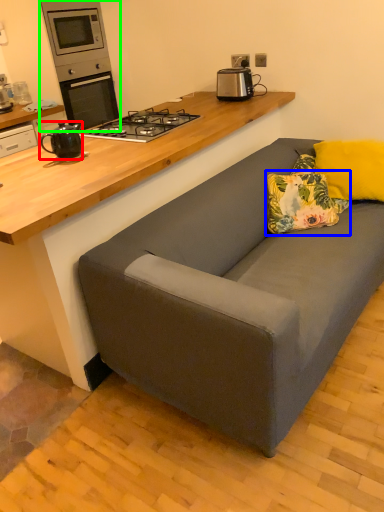
Question: Considering the real-world distances, which object is farthest from kitchen appliance (highlighted by a red box)? pillow (highlighted by a blue box) or home appliance (highlighted by a green box)?

Choices:
 (A) pillow
 (B) home appliance

Answer: (B)